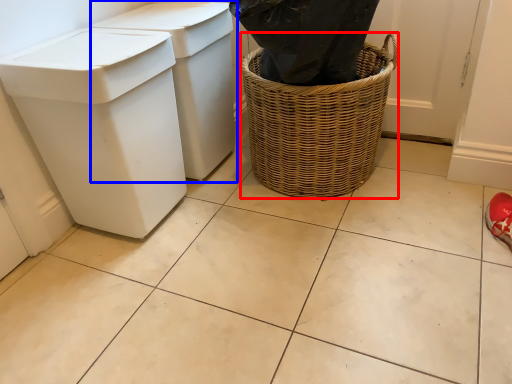
Question: Which object appears closest to the camera in this image, basket container (highlighted by a red box) or waste container (highlighted by a blue box)?

Choices:
 (A) basket container
 (B) waste container

Answer: (A)